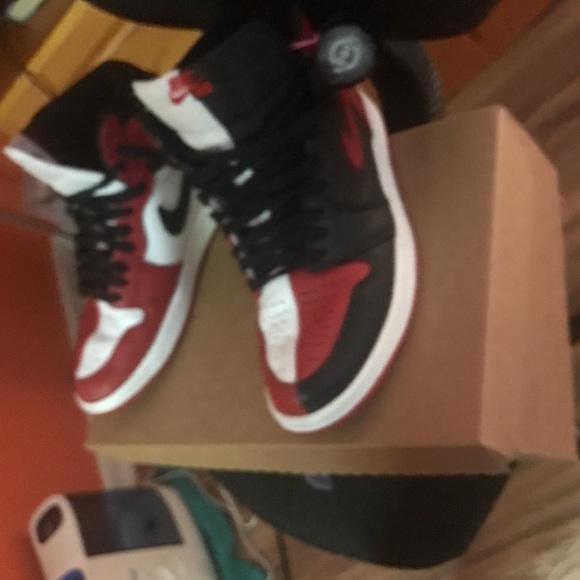
In order to click on wall in this screenshot , I will do `click(30, 435)`.